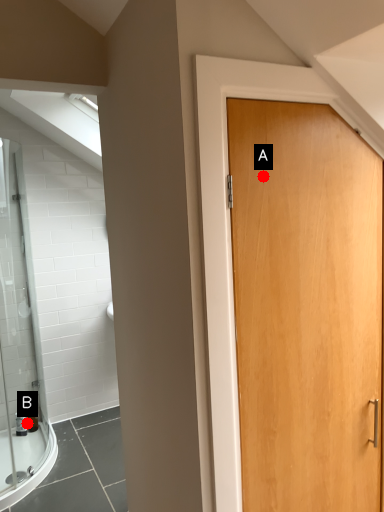
Question: Two points are circled on the image, labeled by A and B beside each circle. Which point is further to the camera?

Choices:
 (A) A is further
 (B) B is further

Answer: (B)